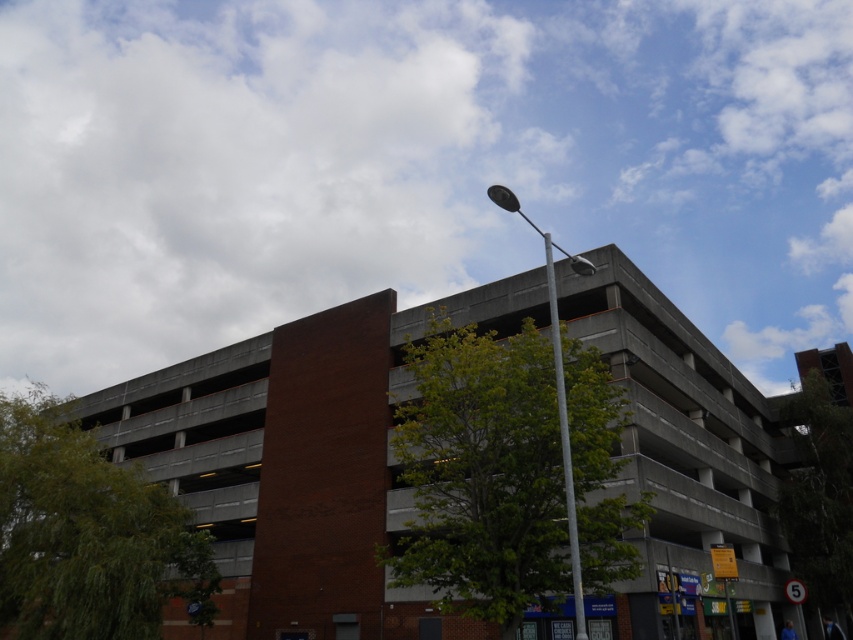
You are standing at the point marked as point (556, 392) in the parking structure image. What object is located exactly at this point?

The metallic pole at upper center is located exactly at point (556, 392).

You are standing in front of the parking structure and notice a white fluffy cloud at upper center and a silver metallic pole at upper center. Which object is closer to you?

The white fluffy cloud at upper center is closer to you because it is further to the viewer than the silver metallic pole at upper center.